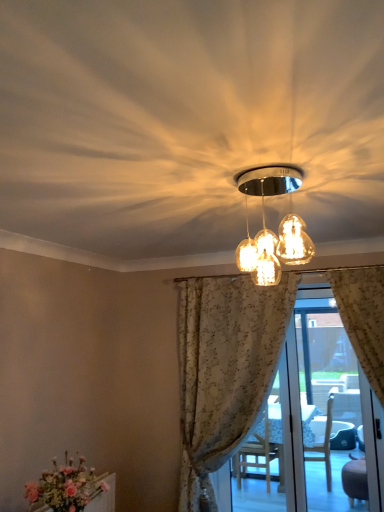
Question: From a real-world perspective, is matte glass light fixture at center positioned above or below translucent floral curtains at center?

Choices:
 (A) below
 (B) above

Answer: (B)

Question: From the image's perspective, is matte glass light fixture at center above or below translucent floral curtains at center?

Choices:
 (A) above
 (B) below

Answer: (A)

Question: Which of these objects is positioned farthest from the translucent floral curtains at center?

Choices:
 (A) matte pink flowers at lower left
 (B) matte glass light fixture at center
 (C) floral fabric curtain at center

Answer: (B)

Question: Which of these objects is positioned closest to the matte glass light fixture at center?

Choices:
 (A) translucent floral curtains at center
 (B) floral fabric curtain at center
 (C) matte pink flowers at lower left

Answer: (C)